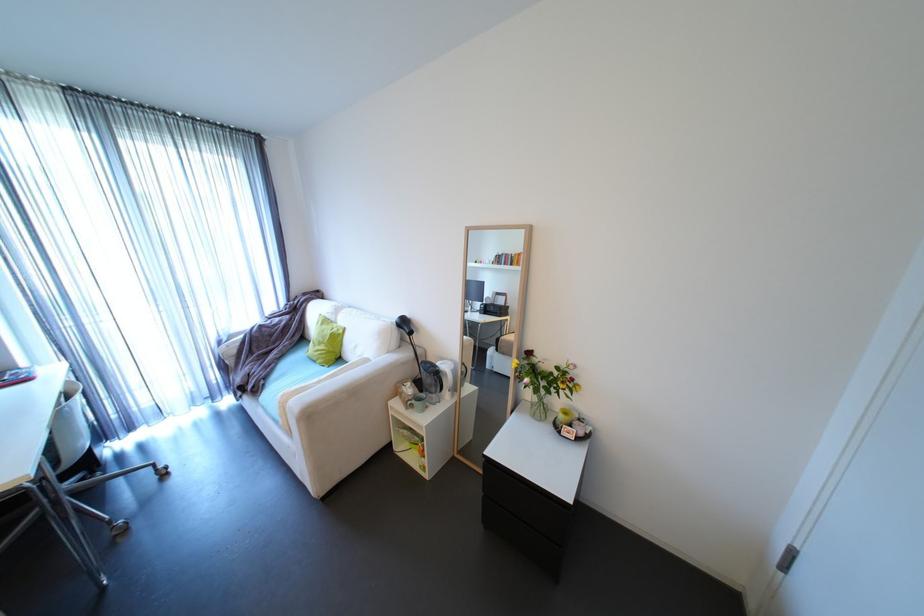
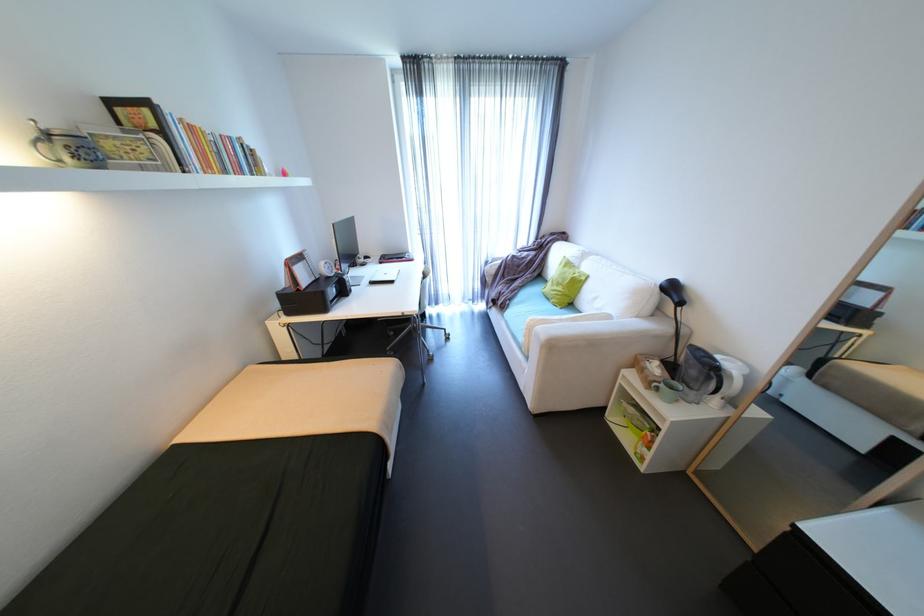
How did the camera likely rotate?

The camera rotated toward left-down.